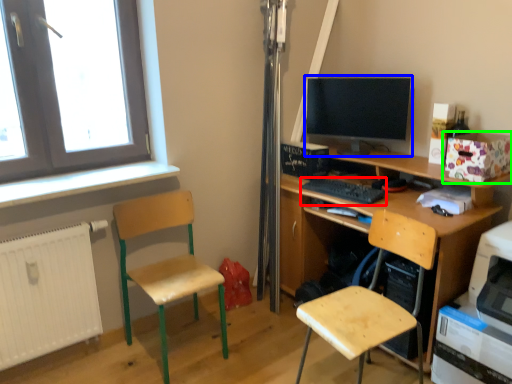
Question: Which object is the farthest from keyboard (highlighted by a red box)? Choose among these: computer monitor (highlighted by a blue box) or box (highlighted by a green box).

Choices:
 (A) computer monitor
 (B) box

Answer: (B)